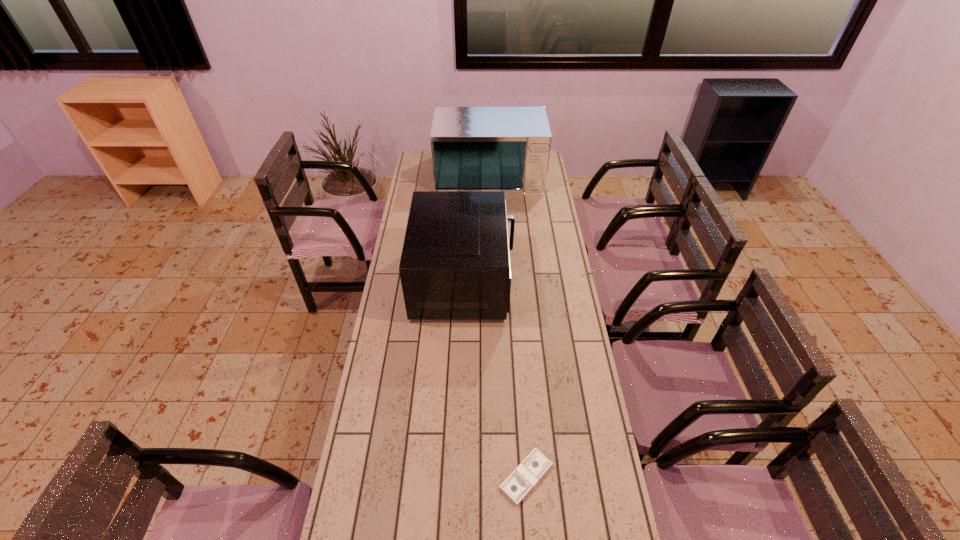
The image size is (960, 540). In order to click on object that is positioned at the far left corner in this screenshot , I will do `click(507, 149)`.

At what (x,y) coordinates should I click in order to perform the action: click on object situated at the far right corner. Please return your answer as a coordinate pair (x, y). The width and height of the screenshot is (960, 540). Looking at the image, I should click on (507, 149).

I want to click on free space at the left edge of the desktop, so click(406, 198).

Where is `free point between the nearest object and the farther microwave_oven`? This screenshot has width=960, height=540. free point between the nearest object and the farther microwave_oven is located at coordinates (508, 325).

This screenshot has width=960, height=540. In order to click on vacant area between the shortest object and the nearer microwave_oven in this screenshot , I will do `click(495, 379)`.

Locate which object ranks second in proximity to the nearer microwave_oven. Please provide its 2D coordinates. Your answer should be formatted as a tuple, i.e. [(x, y)], where the tuple contains the x and y coordinates of a point satisfying the conditions above.

[(522, 480)]

Identify which object is located as the second nearest to the second nearest object. Please provide its 2D coordinates. Your answer should be formatted as a tuple, i.e. [(x, y)], where the tuple contains the x and y coordinates of a point satisfying the conditions above.

[(522, 480)]

Locate an element on the screen. The width and height of the screenshot is (960, 540). free space that satisfies the following two spatial constraints: 1. on the front-facing side of the dollar; 2. on the left side of the second farthest object is located at coordinates (457, 477).

I want to click on vacant region that satisfies the following two spatial constraints: 1. on the back side of the dollar; 2. on the front-facing side of the nearer microwave_oven, so (x=512, y=280).

Where is `vacant space that satisfies the following two spatial constraints: 1. on the front-facing side of the nearest object; 2. on the right side of the nearer microwave_oven`? This screenshot has height=540, width=960. vacant space that satisfies the following two spatial constraints: 1. on the front-facing side of the nearest object; 2. on the right side of the nearer microwave_oven is located at coordinates (457, 477).